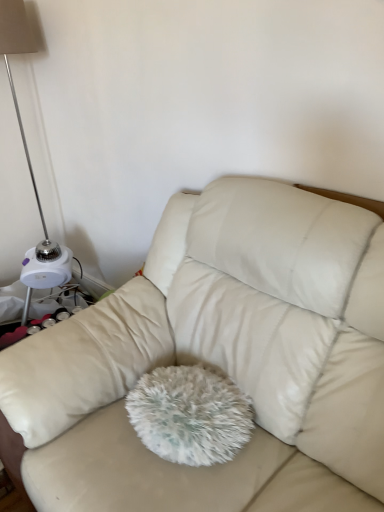
Question: Is beige leather couch at center to the left of white plastic lamp at left from the viewer's perspective?

Choices:
 (A) no
 (B) yes

Answer: (A)

Question: Can you confirm if beige leather couch at center is bigger than white plastic lamp at left?

Choices:
 (A) no
 (B) yes

Answer: (B)

Question: From the image's perspective, is beige leather couch at center beneath white plastic lamp at left?

Choices:
 (A) yes
 (B) no

Answer: (A)

Question: Is beige leather couch at center smaller than white plastic lamp at left?

Choices:
 (A) yes
 (B) no

Answer: (B)

Question: From a real-world perspective, is beige leather couch at center under white plastic lamp at left?

Choices:
 (A) no
 (B) yes

Answer: (B)

Question: Does beige leather couch at center have a lesser height compared to white plastic lamp at left?

Choices:
 (A) no
 (B) yes

Answer: (B)

Question: From the image's perspective, is white plastic lamp at left beneath beige leather couch at center?

Choices:
 (A) yes
 (B) no

Answer: (B)

Question: Does white plastic lamp at left have a greater width compared to beige leather couch at center?

Choices:
 (A) no
 (B) yes

Answer: (A)

Question: Is white plastic lamp at left to the right of beige leather couch at center from the viewer's perspective?

Choices:
 (A) no
 (B) yes

Answer: (A)

Question: Is white plastic lamp at left far from beige leather couch at center?

Choices:
 (A) yes
 (B) no

Answer: (A)

Question: Are white plastic lamp at left and beige leather couch at center beside each other?

Choices:
 (A) yes
 (B) no

Answer: (B)

Question: Does white plastic lamp at left have a larger size compared to beige leather couch at center?

Choices:
 (A) yes
 (B) no

Answer: (B)

Question: In terms of height, does beige leather couch at center look taller or shorter compared to white plastic lamp at left?

Choices:
 (A) short
 (B) tall

Answer: (A)